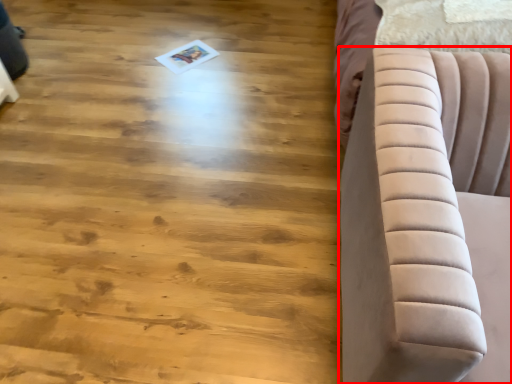
Question: From the image, what is the correct spatial relationship of furniture (annotated by the red box) in relation to hardwood?

Choices:
 (A) right
 (B) left

Answer: (A)